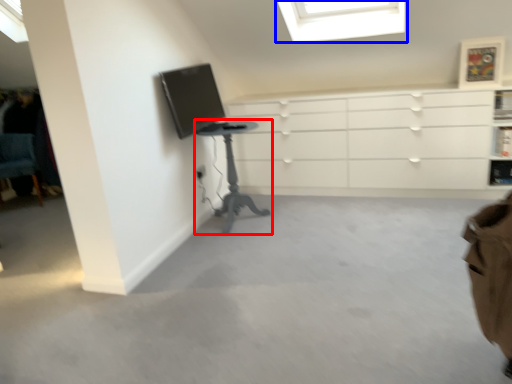
Question: Which point is further to the camera, table (highlighted by a red box) or window (highlighted by a blue box)?

Choices:
 (A) table
 (B) window

Answer: (B)